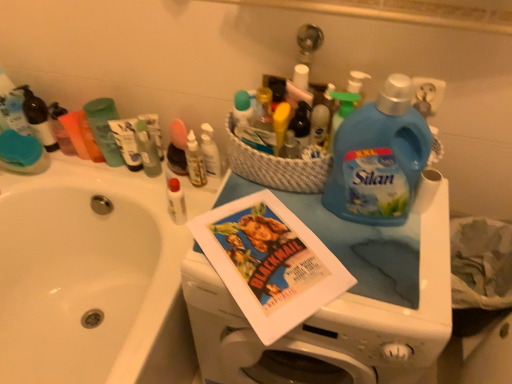
Locate an element on the screen. free location above matte paper comic book at center (from a real-world perspective) is located at coordinates (270, 230).